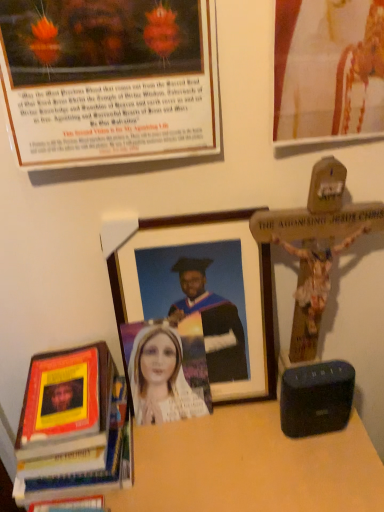
You are a GUI agent. You are given a task and a screenshot of the screen. Output one action in this format:
    pyautogui.click(x=<x>, y=<y>)
    Task: Click on the free space to the left of black plastic speaker at lower right
    The width and height of the screenshot is (384, 512).
    Given the screenshot: What is the action you would take?
    pyautogui.click(x=231, y=442)